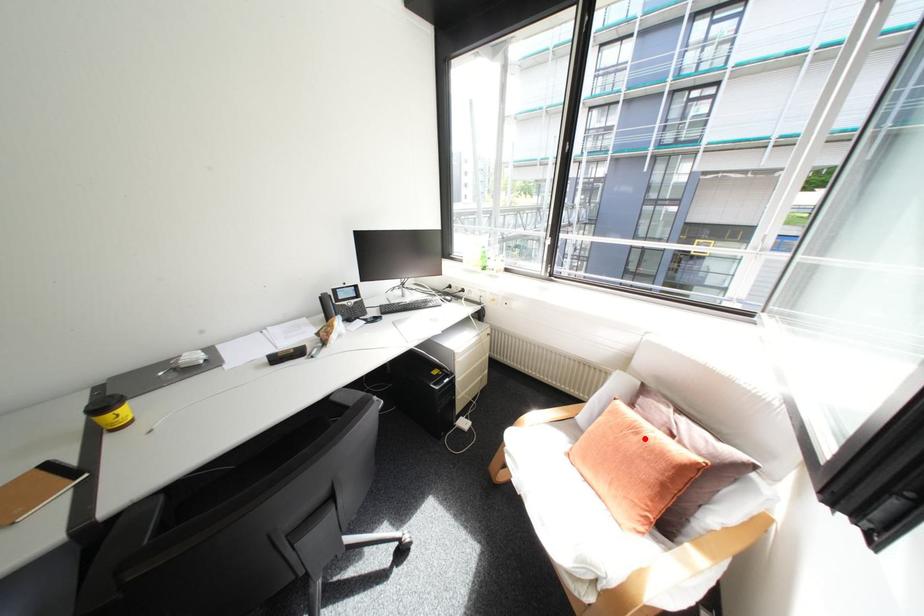
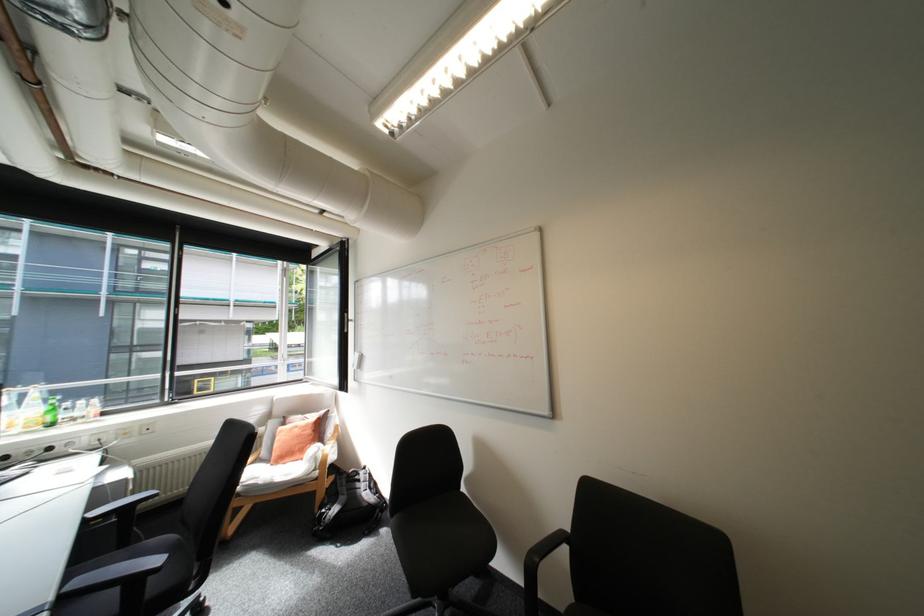
Find the pixel in the second image that matches the highlighted location in the first image.

(307, 429)